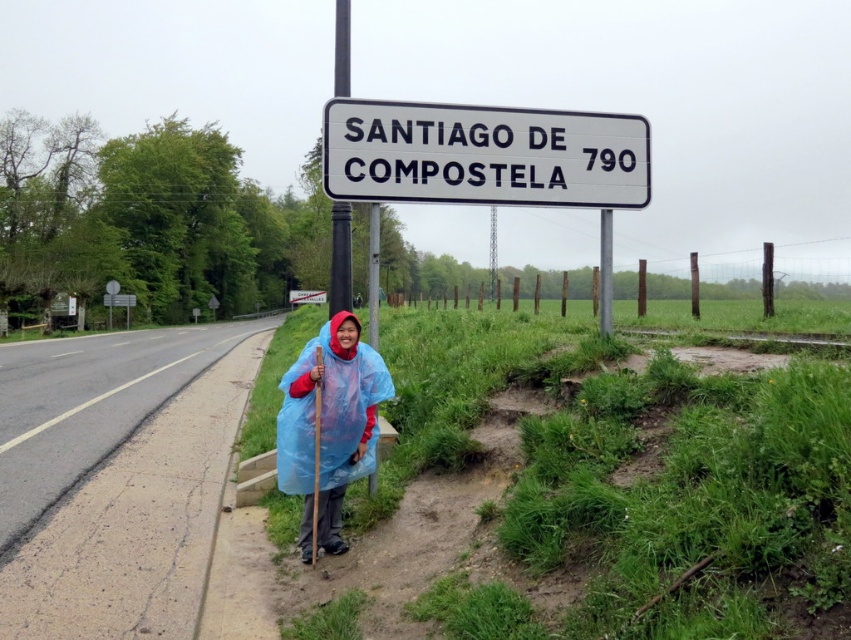
Question: Does transparent blue poncho at center have a lesser width compared to black metal signpost at upper center?

Choices:
 (A) yes
 (B) no

Answer: (A)

Question: Which point is farther to the camera?

Choices:
 (A) (337, 67)
 (B) (634, 116)
 (C) (347, 337)

Answer: (A)

Question: Which point is farther to the camera?

Choices:
 (A) (410, 172)
 (B) (338, 26)
 (C) (343, 348)

Answer: (B)

Question: Is transparent blue poncho at center above black metal signpost at upper center?

Choices:
 (A) yes
 (B) no

Answer: (B)

Question: Which point is closer to the camera?

Choices:
 (A) transparent blue poncho at center
 (B) black metal signpost at upper center

Answer: (A)

Question: Is transparent blue poncho at center wider than black metal signpost at upper center?

Choices:
 (A) no
 (B) yes

Answer: (A)